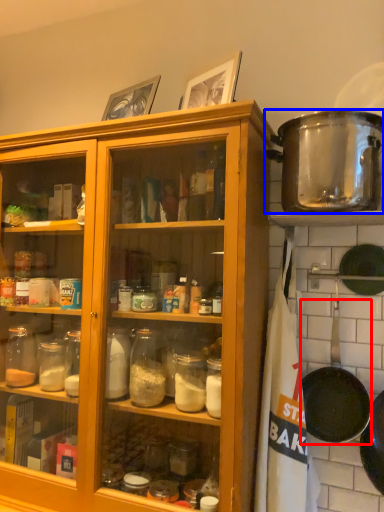
Question: Which object appears closest to the camera in this image, frying pan (highlighted by a red box) or pot/pan (highlighted by a blue box)?

Choices:
 (A) frying pan
 (B) pot/pan

Answer: (B)